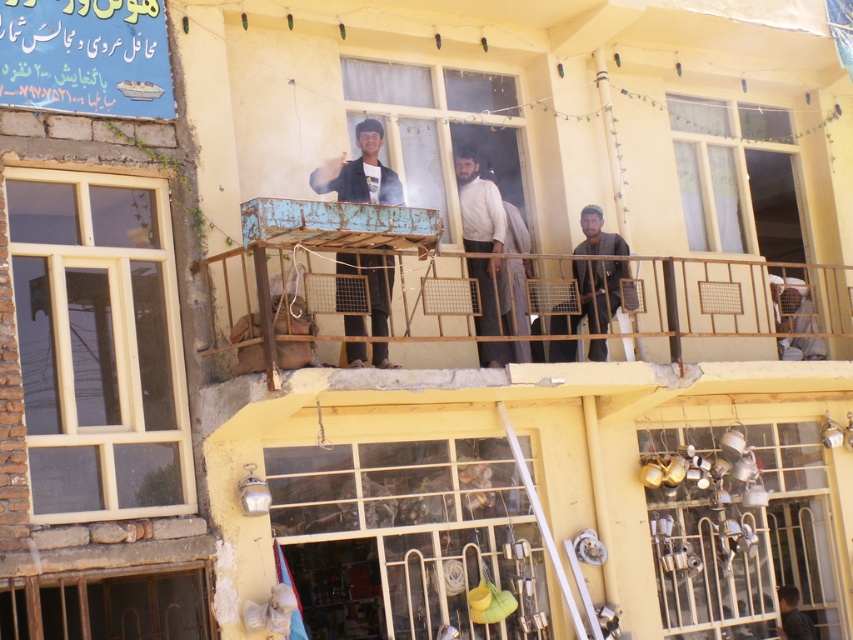
Measure the distance from dark blue shirt at center to dark gray shirt at lower right.

A distance of 32.67 feet exists between dark blue shirt at center and dark gray shirt at lower right.

Between point (375, 144) and point (786, 611), which one is positioned behind?

The point (786, 611) is behind.

What do you see at coordinates (360, 172) in the screenshot?
I see `dark blue shirt at center` at bounding box center [360, 172].

This screenshot has height=640, width=853. What are the coordinates of `dark blue shirt at center` in the screenshot? It's located at click(x=360, y=172).

Consider the image. Between transparent glass window at center and metallic/reflective pots and pans at lower right, which one is positioned higher?

metallic/reflective pots and pans at lower right

Who is positioned more to the left, transparent glass window at center or metallic/reflective pots and pans at lower right?

Positioned to the left is transparent glass window at center.

This screenshot has width=853, height=640. I want to click on transparent glass window at center, so click(405, 536).

This screenshot has height=640, width=853. Identify the location of transparent glass window at center. 405,536.

Which is more to the left, brown wooden balcony at center or dark blue shirt at center?

dark blue shirt at center is more to the left.

Is brown wooden balcony at center positioned at the back of dark blue shirt at center?

No, brown wooden balcony at center is in front of dark blue shirt at center.

Which is in front, point (581, 300) or point (386, 342)?

Point (386, 342) is in front.

Locate an element on the screen. This screenshot has width=853, height=640. brown wooden balcony at center is located at coordinates (537, 300).